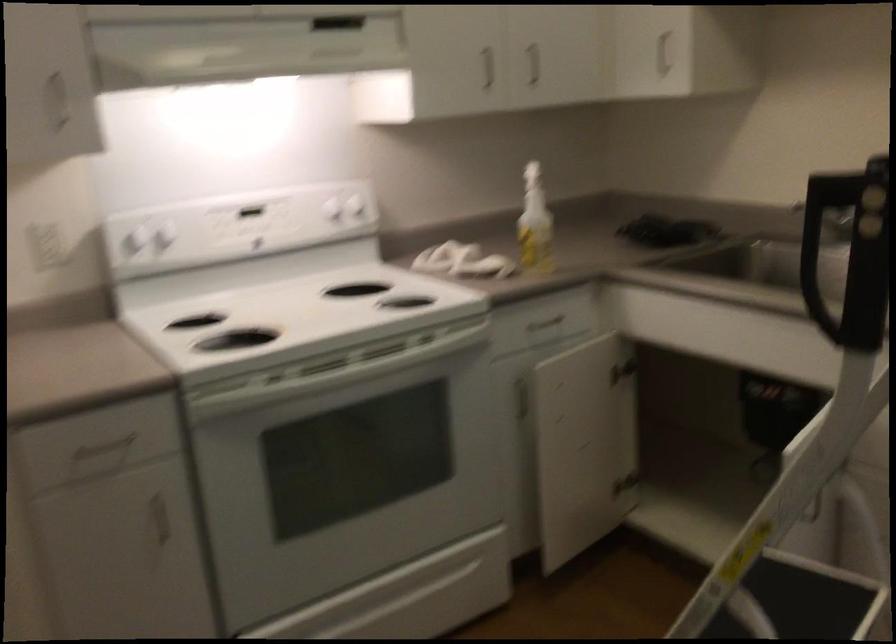
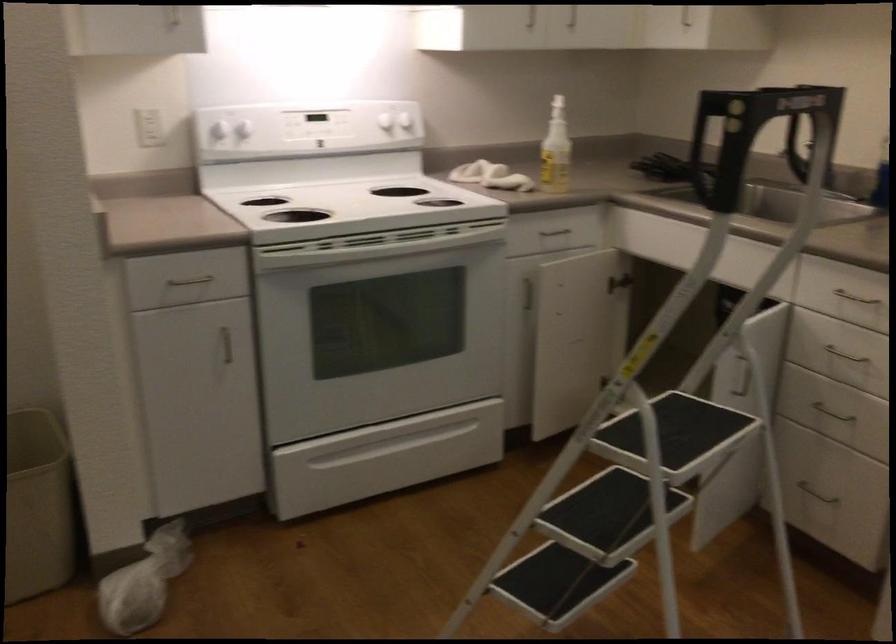
The point at (x=334, y=213) is marked in the first image. Where is the corresponding point in the second image?

(384, 120)